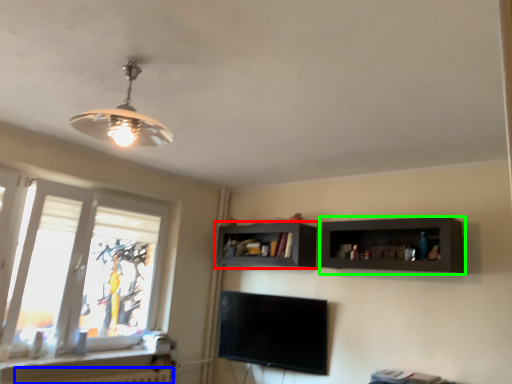
Question: Based on their relative distances, which object is nearer to shelf (highlighted by a red box)? Choose from radiator (highlighted by a blue box) and shelf (highlighted by a green box).

Choices:
 (A) radiator
 (B) shelf

Answer: (B)